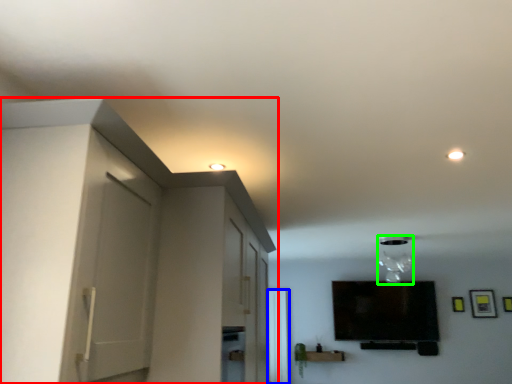
Question: Considering the real-world distances, which object is farthest from dresser (highlighted by a red box)? window (highlighted by a blue box) or light fixture (highlighted by a green box)?

Choices:
 (A) window
 (B) light fixture

Answer: (A)